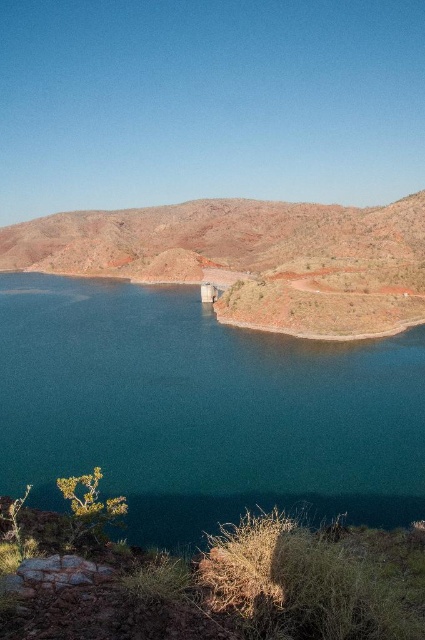
Question: Which point is closer to the camera taking this photo?

Choices:
 (A) (258, 288)
 (B) (306, 362)

Answer: (B)

Question: Does teal glossy water at center have a greater width compared to rustic brown hillside at center?

Choices:
 (A) yes
 (B) no

Answer: (B)

Question: Is teal glossy water at center bigger than rustic brown hillside at center?

Choices:
 (A) no
 (B) yes

Answer: (A)

Question: Among these objects, which one is nearest to the camera?

Choices:
 (A) rustic brown hillside at center
 (B) teal glossy water at center

Answer: (B)

Question: Observing the image, what is the correct spatial positioning of teal glossy water at center in reference to rustic brown hillside at center?

Choices:
 (A) below
 (B) above

Answer: (A)